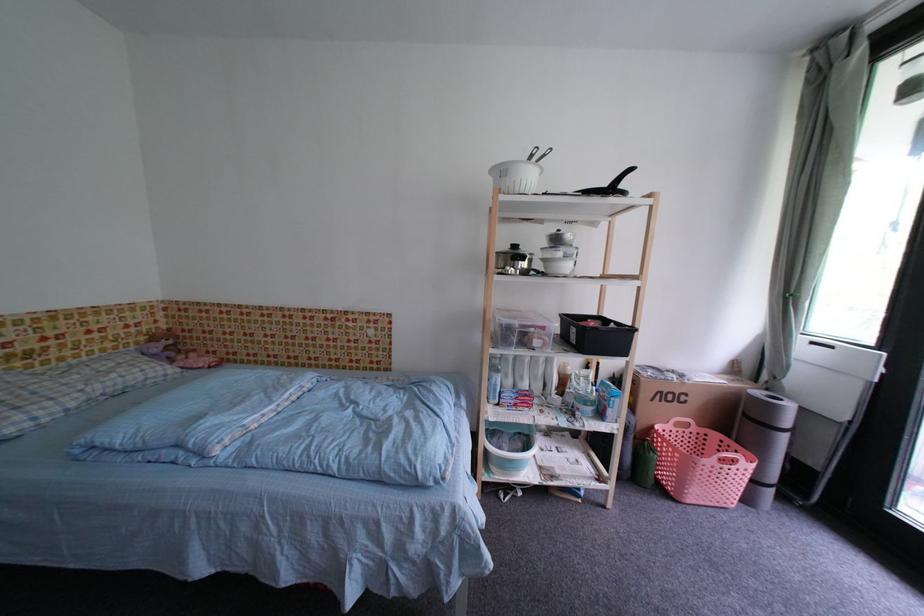
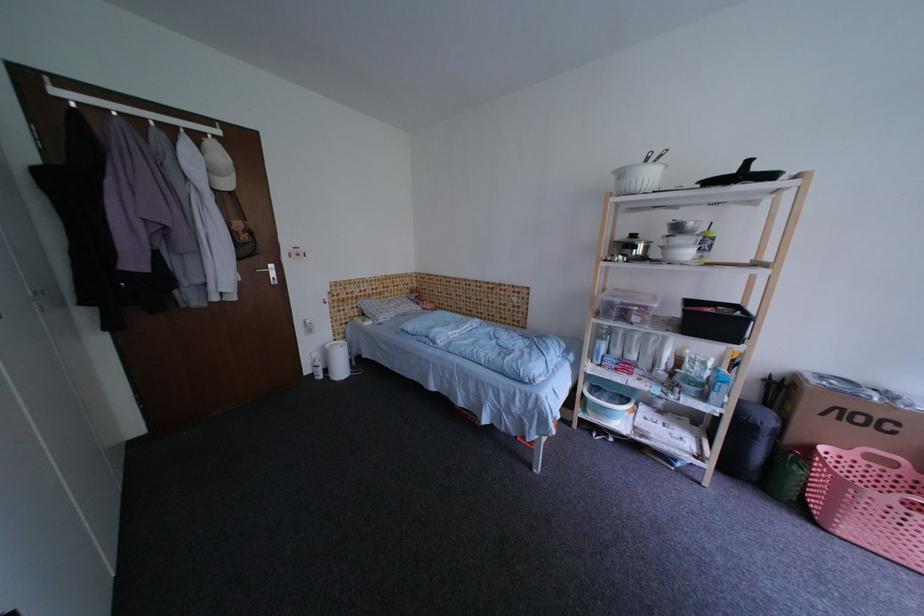
In the second image, find the point that corresponds to (523,249) in the first image.

(641, 238)